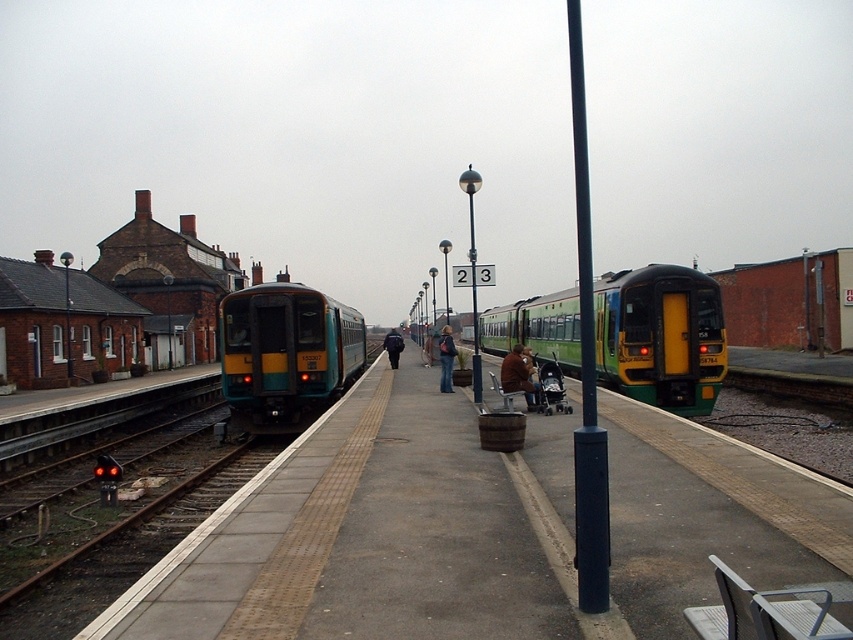
Question: Observing the image, what is the correct spatial positioning of green/yellow plastic train at center in reference to teal/yellow metal train at center?

Choices:
 (A) above
 (B) below

Answer: (A)

Question: Which of the following is the closest to the observer?

Choices:
 (A) (616, 308)
 (B) (448, 340)
 (C) (519, 387)

Answer: (C)

Question: Estimate the real-world distances between objects in this image. Which object is closer to the dark brown leather jacket at center?

Choices:
 (A) dark blue jacket at center
 (B) brown leather jacket at center
 (C) green/yellow plastic train at center
 (D) teal/yellow metal train at center

Answer: (B)

Question: Is teal/yellow metal train at center in front of dark brown leather jacket at center?

Choices:
 (A) no
 (B) yes

Answer: (B)

Question: Based on their relative distances, which object is nearer to the teal/yellow metal train at center?

Choices:
 (A) dark brown leather jacket at center
 (B) green/yellow plastic train at center

Answer: (A)

Question: Can you confirm if green/yellow plastic train at center is wider than brown leather jacket at center?

Choices:
 (A) no
 (B) yes

Answer: (B)